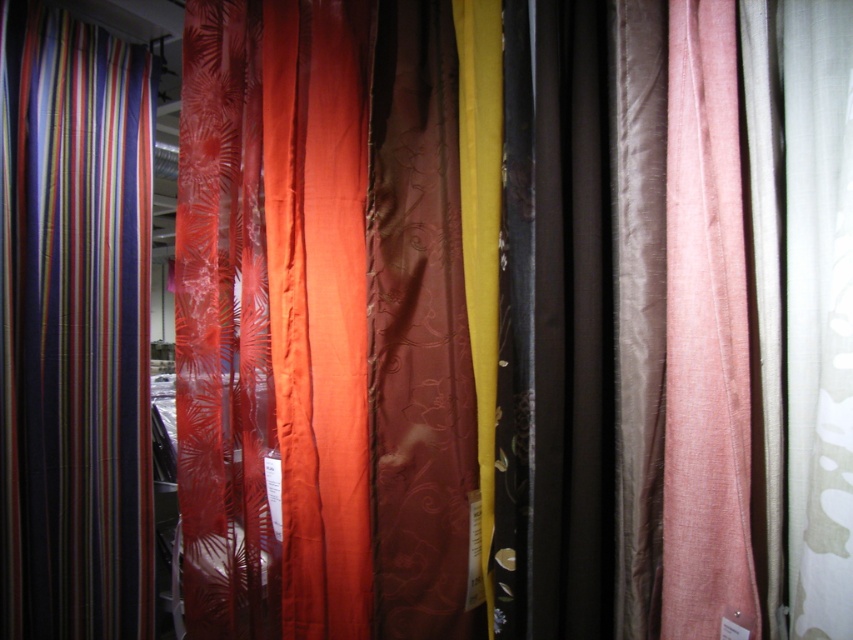
Question: Which of the following is the farthest from the observer?

Choices:
 (A) pink sheer curtain at right
 (B) satin orange curtain at center
 (C) multicolored striped fabric at left

Answer: (C)

Question: Is satin orange curtain at center bigger than brown satin curtain at center?

Choices:
 (A) no
 (B) yes

Answer: (B)

Question: Is brown satin curtain at center smaller than pink sheer curtain at right?

Choices:
 (A) yes
 (B) no

Answer: (B)

Question: Among these objects, which one is nearest to the camera?

Choices:
 (A) multicolored striped fabric at left
 (B) pink sheer curtain at right
 (C) brown satin curtain at center

Answer: (B)

Question: Does multicolored striped fabric at left appear over satin orange curtain at center?

Choices:
 (A) no
 (B) yes

Answer: (A)

Question: Which object appears farthest from the camera in this image?

Choices:
 (A) pink sheer curtain at right
 (B) brown satin curtain at center
 (C) multicolored striped fabric at left
 (D) satin orange curtain at center

Answer: (C)